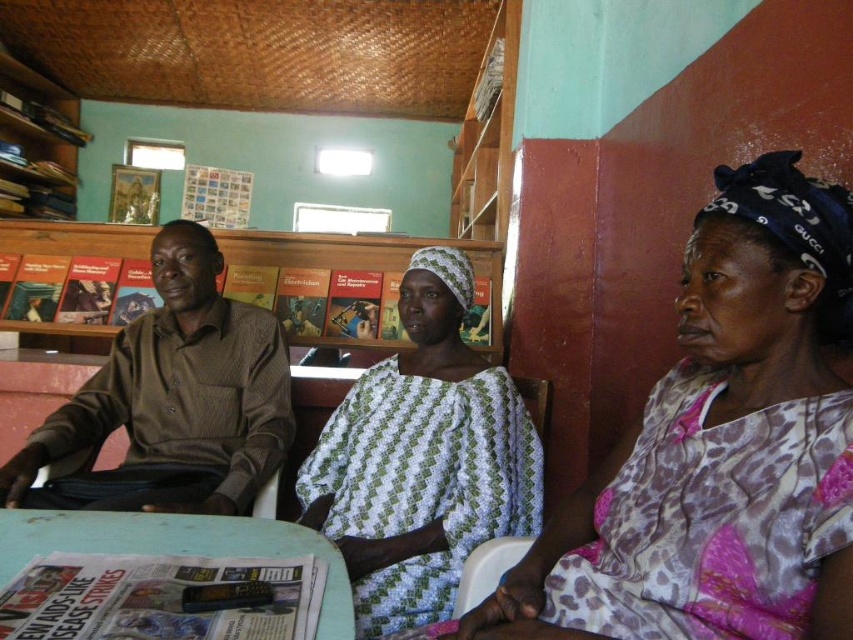
You are a photographer setting up a shoot in this room. You need to place a small decorative item between the printed fabric headscarf at upper right and the wooden bookshelf at upper left. Which object should the item be closer to if you want it to balance the visual weight based on their sizes?

The printed fabric headscarf at upper right has a smaller size compared to wooden bookshelf at upper left, so the decorative item should be placed closer to the printed fabric headscarf at upper right to balance their visual weights.

From the picture: You are organizing a small event and need to place a large decorative centerpiece on the light blue plastic table at lower center. Considering the space it occupies compared to the wooden bookshelf at upper left, will the table be able to accommodate the centerpiece without overcrowding?

The light blue plastic table at lower center occupies less space than the wooden bookshelf at upper left. Therefore, placing a large decorative centerpiece might overcrowd the table since it has limited space compared to the bookshelf.

Where is the printed fabric headscarf at upper right located in the image?

The printed fabric headscarf at upper right is located at point (720, 448).